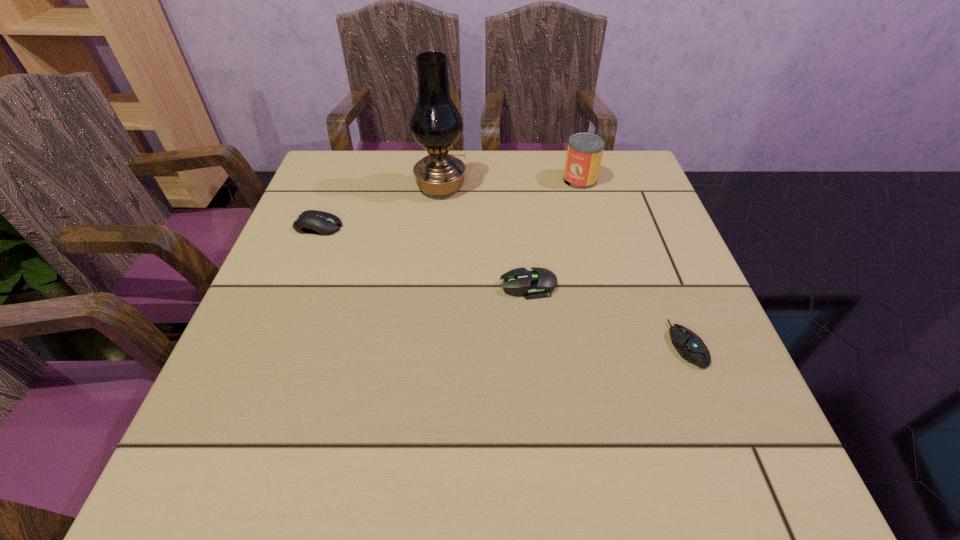
Find the location of a particular element. Image resolution: width=960 pixels, height=540 pixels. free point between the second computer mouse from left to right and the nearest object is located at coordinates (607, 315).

The image size is (960, 540). In order to click on free spot between the rightmost computer mouse and the second tallest object in this screenshot , I will do tap(633, 262).

Find the location of `empty space between the third farthest object and the third object from right to left`. empty space between the third farthest object and the third object from right to left is located at coordinates coord(423,256).

What are the coordinates of `vacant point located between the oil lamp and the can` in the screenshot? It's located at (511, 183).

You are a GUI agent. You are given a task and a screenshot of the screen. Output one action in this format:
    pyautogui.click(x=<x>, y=<y>)
    Task: Click on the free spot between the third object from left to right and the rightmost object
    This screenshot has width=960, height=540.
    Given the screenshot: What is the action you would take?
    pyautogui.click(x=607, y=315)

Find the location of a particular element. This screenshot has height=540, width=960. free space between the third object from left to right and the rightmost object is located at coordinates (607, 315).

I want to click on vacant point located between the fourth shortest object and the leftmost object, so click(449, 203).

Locate an element on the screen. This screenshot has width=960, height=540. vacant area that lies between the rightmost computer mouse and the oil lamp is located at coordinates (564, 266).

Locate an element on the screen. object that can be found as the closest to the leftmost computer mouse is located at coordinates (435, 123).

At what (x,y) coordinates should I click in order to perform the action: click on object that can be found as the closest to the third farthest object. Please return your answer as a coordinate pair (x, y). The width and height of the screenshot is (960, 540). Looking at the image, I should click on (435, 123).